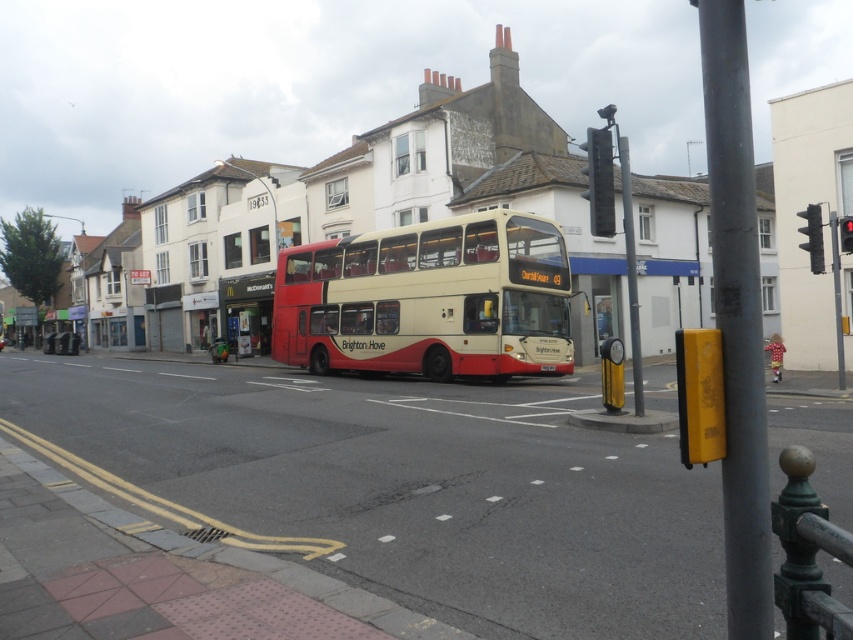
Question: Which is nearer to the black plastic traffic light at upper center?

Choices:
 (A) white plastic license plate at center
 (B) black plastic mcdonald's sign at center
 (C) metallic red traffic light at right

Answer: (A)

Question: Considering the relative positions of black plastic mcdonald's sign at center and red plastic traffic light at upper right in the image provided, where is black plastic mcdonald's sign at center located with respect to red plastic traffic light at upper right?

Choices:
 (A) below
 (B) above

Answer: (A)

Question: Is metallic red traffic light at right in front of white plastic license plate at center?

Choices:
 (A) yes
 (B) no

Answer: (A)

Question: Can you confirm if matte cream double-decker bus at center is smaller than metallic red traffic light at right?

Choices:
 (A) no
 (B) yes

Answer: (A)

Question: Which of the following is the farthest from the observer?

Choices:
 (A) matte cream double-decker bus at center
 (B) white plastic license plate at center
 (C) red plastic traffic light at upper right

Answer: (B)

Question: Which point is closer to the camera?

Choices:
 (A) black plastic mcdonald's sign at center
 (B) metallic red traffic light at right
 (C) black plastic traffic light at upper center

Answer: (C)